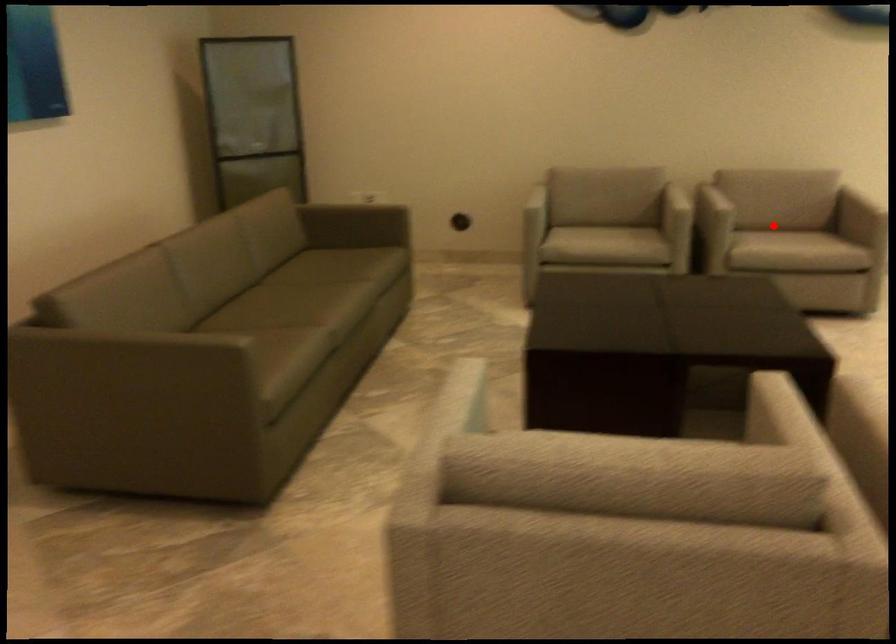
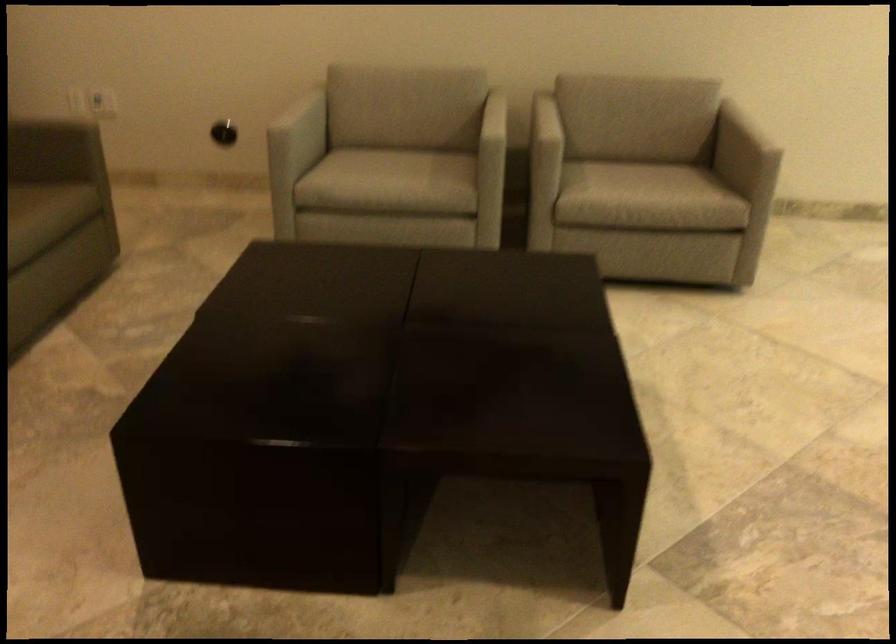
In the second image, find the point that corresponds to the highlighted location in the first image.

(633, 160)